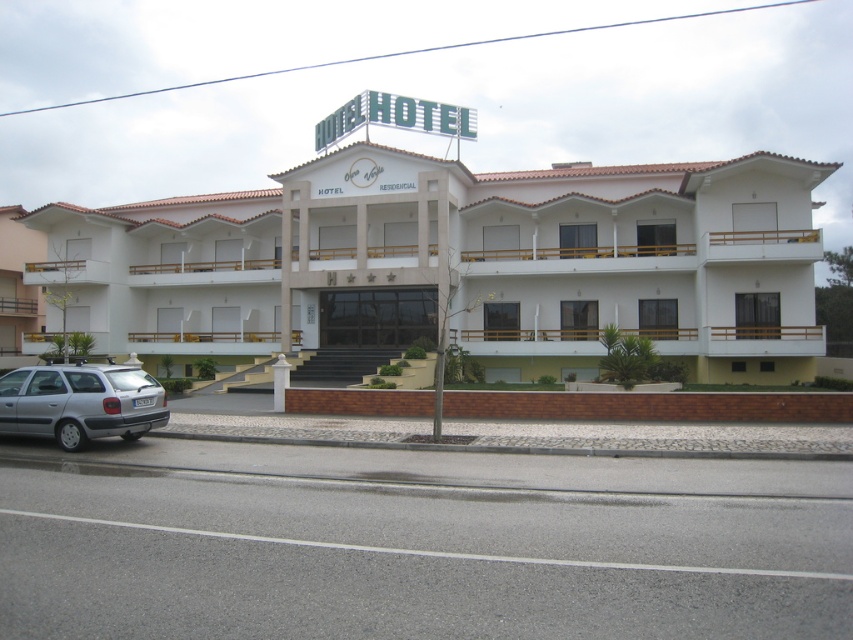
Describe the element at coordinates (456, 262) in the screenshot. The height and width of the screenshot is (640, 853). I see `white matte building at center` at that location.

Between white matte building at center and silver metallic car at lower left, which one is positioned lower?

Positioned lower is silver metallic car at lower left.

Where is `white matte building at center`? The height and width of the screenshot is (640, 853). white matte building at center is located at coordinates (456, 262).

This screenshot has width=853, height=640. In order to click on white matte building at center in this screenshot , I will do `click(456, 262)`.